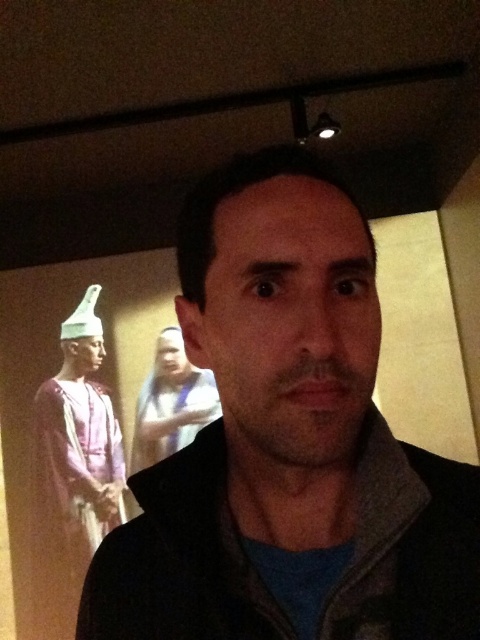
Question: Is the position of black fleece jacket at center more distant than that of smooth beige scarf at center?

Choices:
 (A) yes
 (B) no

Answer: (B)

Question: Among these points, which one is farthest from the camera?

Choices:
 (A) (133, 435)
 (B) (371, 417)
 (C) (96, 358)
 (D) (333, 326)

Answer: (C)

Question: Can you confirm if matte black jacket at center is positioned to the right of matte purple fabric at left?

Choices:
 (A) no
 (B) yes

Answer: (B)

Question: Can you confirm if black fleece jacket at center is wider than smooth beige scarf at center?

Choices:
 (A) yes
 (B) no

Answer: (B)

Question: Which of the following is the farthest from the observer?

Choices:
 (A) (84, 536)
 (B) (437, 611)

Answer: (A)

Question: Which point is farther to the camera?

Choices:
 (A) smooth beige scarf at center
 (B) black fleece jacket at center
 (C) matte black jacket at center

Answer: (A)